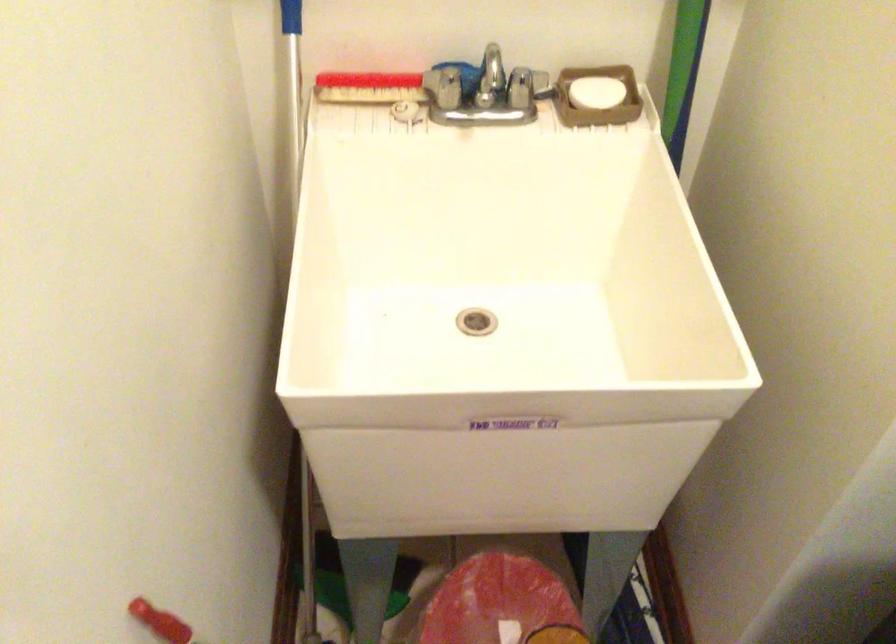
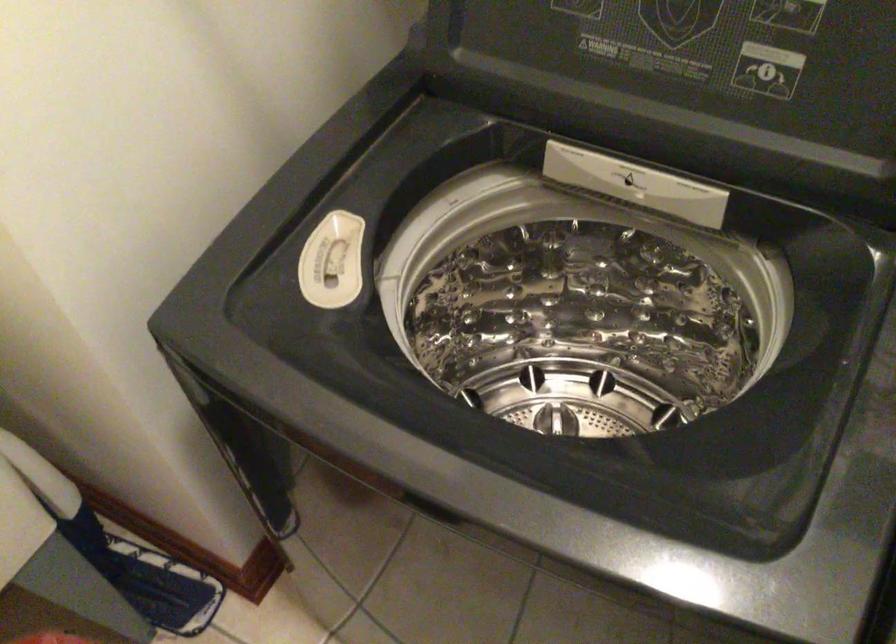
The images are taken continuously from a first-person perspective. In which direction is your viewpoint rotating?

The camera rotated toward right-down.